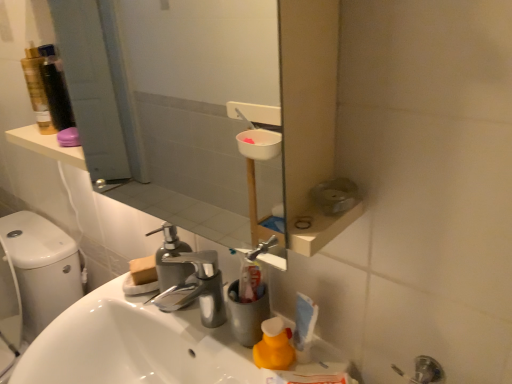
Question: In terms of size, does white glossy sink at center appear bigger or smaller than yellow matte cleaning product at lower center?

Choices:
 (A) big
 (B) small

Answer: (A)

Question: Is white glossy sink at center inside or outside of yellow matte cleaning product at lower center?

Choices:
 (A) outside
 (B) inside

Answer: (A)

Question: Which object is positioned closest to the white glossy sink at center?

Choices:
 (A) yellow matte cleaning product at lower center
 (B) clear glass mirror at upper center
 (C) chrome metallic faucet at center

Answer: (C)

Question: Which object is the farthest from the yellow matte cleaning product at lower center?

Choices:
 (A) white glossy sink at center
 (B) clear glass mirror at upper center
 (C) chrome metallic faucet at center

Answer: (B)